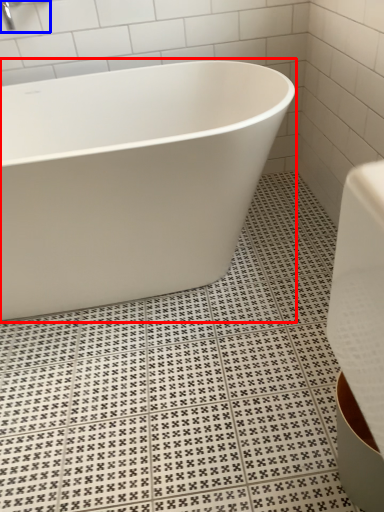
Question: Which of the following is the farthest to the observer, bathtub (highlighted by a red box) or faucet (highlighted by a blue box)?

Choices:
 (A) bathtub
 (B) faucet

Answer: (B)